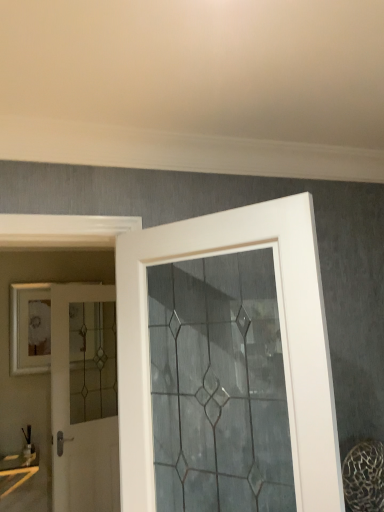
Question: Is white glass door at center, which appears as the second door when viewed from the left, oriented towards white glass door at left, the second door when ordered from right to left?

Choices:
 (A) no
 (B) yes

Answer: (A)

Question: From the image's perspective, would you say white glass door at center, which appears as the second door when viewed from the left, is shown under white glass door at left, the second door when ordered from right to left?

Choices:
 (A) no
 (B) yes

Answer: (A)

Question: Does white glass door at center, which is the first door from right to left, come behind white glass door at left, the first door in the back-to-front sequence?

Choices:
 (A) yes
 (B) no

Answer: (B)

Question: From a real-world perspective, is white glass door at center, which appears as the second door when viewed from the left, physically below white glass door at left, the first door in the back-to-front sequence?

Choices:
 (A) yes
 (B) no

Answer: (B)

Question: Considering the relative sizes of white glass door at center, which is the first door from right to left, and white glass door at left, the first door in the back-to-front sequence, in the image provided, is white glass door at center, which is the first door from right to left, shorter than white glass door at left, the first door in the back-to-front sequence,?

Choices:
 (A) yes
 (B) no

Answer: (A)

Question: Are white glass door at center, the first door from the front, and white glass door at left, the second door when ordered from right to left, beside each other?

Choices:
 (A) no
 (B) yes

Answer: (A)

Question: Is white glass door at left, acting as the first door starting from the left, facing away from white glass door at center, which appears as the second door when viewed from the left?

Choices:
 (A) no
 (B) yes

Answer: (A)

Question: From the image's perspective, does white glass door at left, the first door in the back-to-front sequence, appear lower than white glass door at center, the first door from the front?

Choices:
 (A) yes
 (B) no

Answer: (A)

Question: From a real-world perspective, does white glass door at left, positioned as the second door in front-to-back order, sit lower than white glass door at center, the first door from the front?

Choices:
 (A) no
 (B) yes

Answer: (B)

Question: Is white glass door at left, the second door when ordered from right to left, closer to the viewer compared to white glass door at center, arranged as the second door when viewed from the back?

Choices:
 (A) no
 (B) yes

Answer: (A)

Question: Is white glass door at left, the second door when ordered from right to left, far away from white glass door at center, arranged as the second door when viewed from the back?

Choices:
 (A) no
 (B) yes

Answer: (B)

Question: Is white glass door at left, acting as the first door starting from the left, shorter than white glass door at center, which appears as the second door when viewed from the left?

Choices:
 (A) yes
 (B) no

Answer: (B)

Question: In terms of width, does white glass door at center, arranged as the second door when viewed from the back, look wider or thinner when compared to white glass door at left, the second door when ordered from right to left?

Choices:
 (A) wide
 (B) thin

Answer: (A)